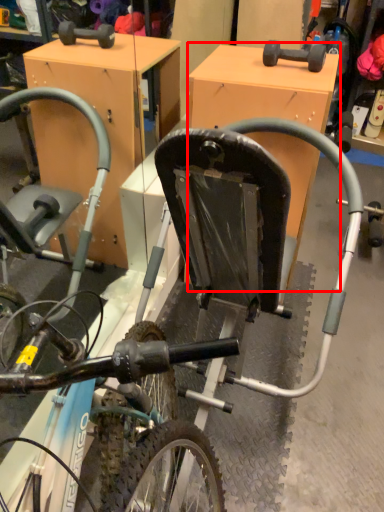
Question: From the image's perspective, where is table (annotated by the red box) located in relation to bicycle in the image?

Choices:
 (A) below
 (B) above

Answer: (A)